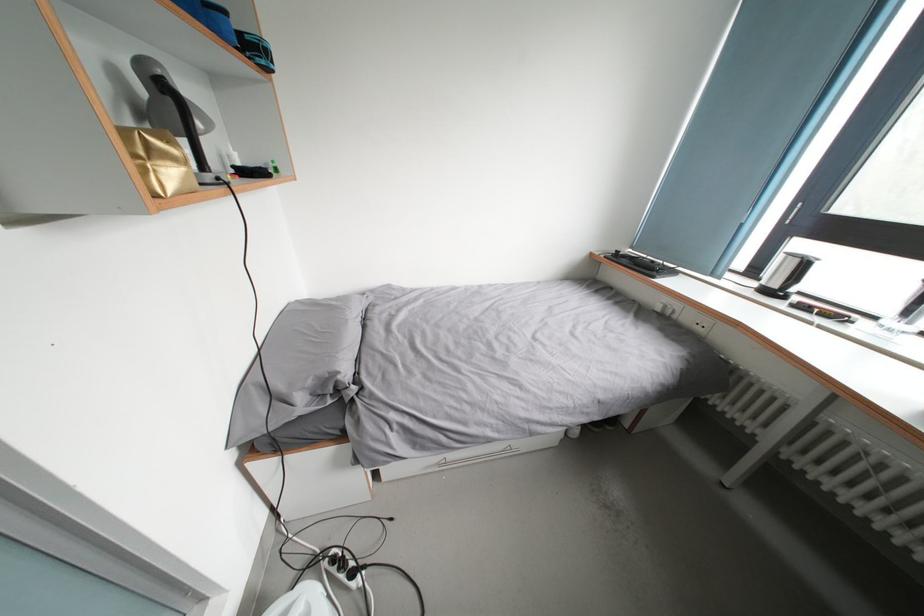
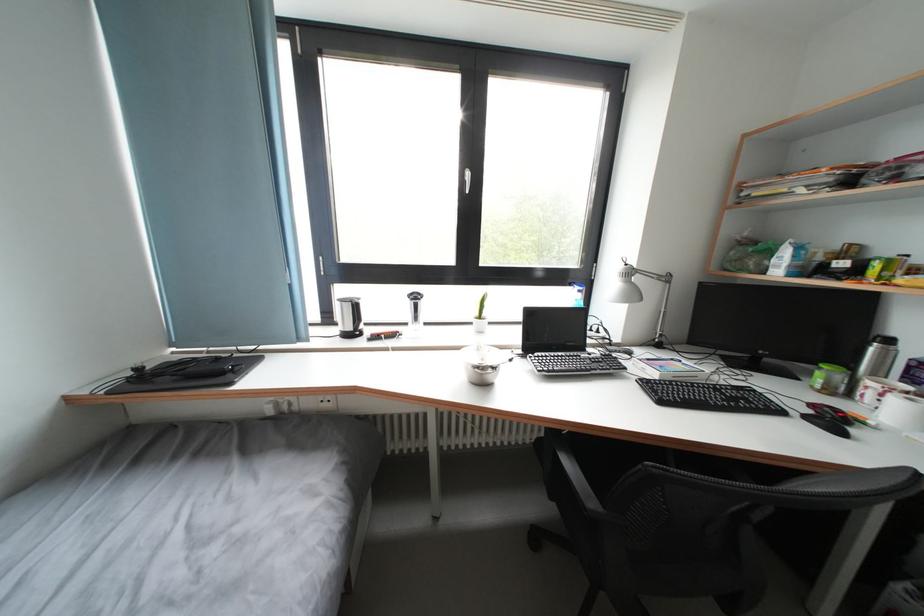
Question: The images are taken continuously from a first-person perspective. In which direction is your viewpoint rotating?

Choices:
 (A) Left
 (B) Right
 (C) Up
 (D) Down

Answer: (B)